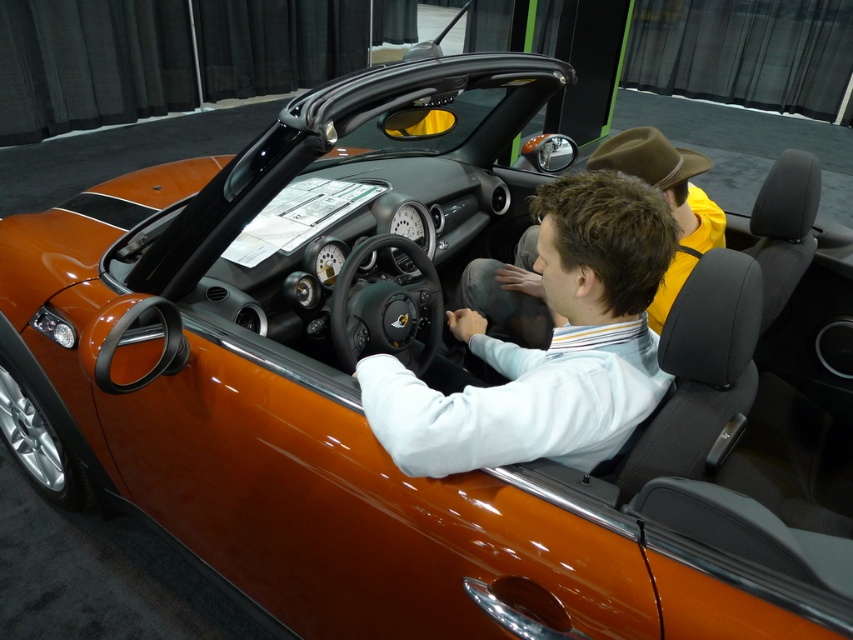
Can you confirm if matte white shirt at center is positioned above matte brown hat at center?

No, matte white shirt at center is not above matte brown hat at center.

Is matte white shirt at center below matte brown hat at center?

Yes, matte white shirt at center is below matte brown hat at center.

What do you see at coordinates (548, 346) in the screenshot? The image size is (853, 640). I see `matte white shirt at center` at bounding box center [548, 346].

Find the location of a particular element. matte white shirt at center is located at coordinates (548, 346).